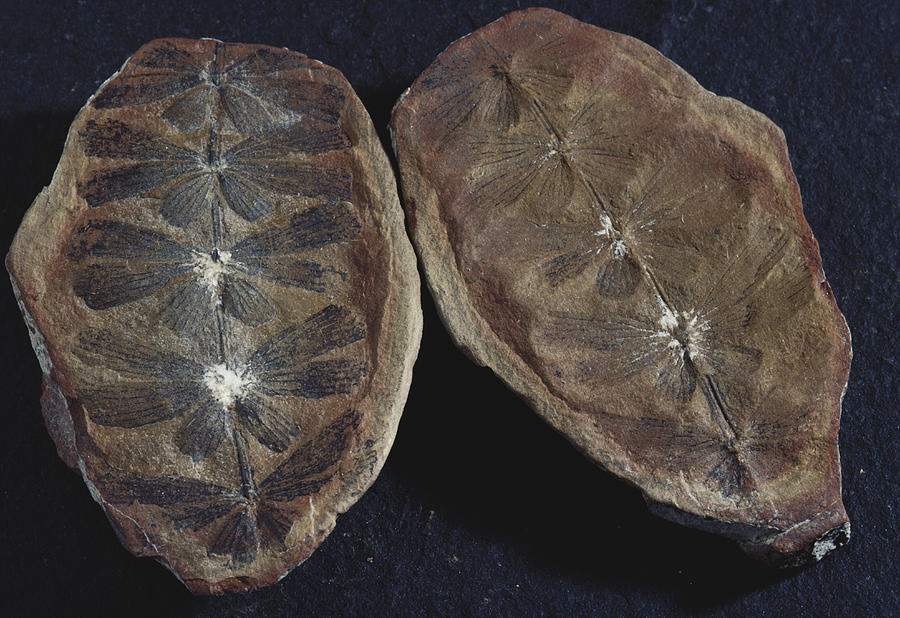
Locate an element on the screen. corner is located at coordinates (886, 25).